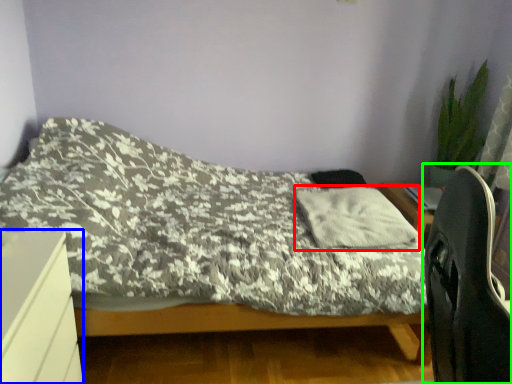
Question: Which object is positioned farthest from pillow (highlighted by a red box)? Select from desk (highlighted by a blue box) and computer chair (highlighted by a green box).

Choices:
 (A) desk
 (B) computer chair

Answer: (A)